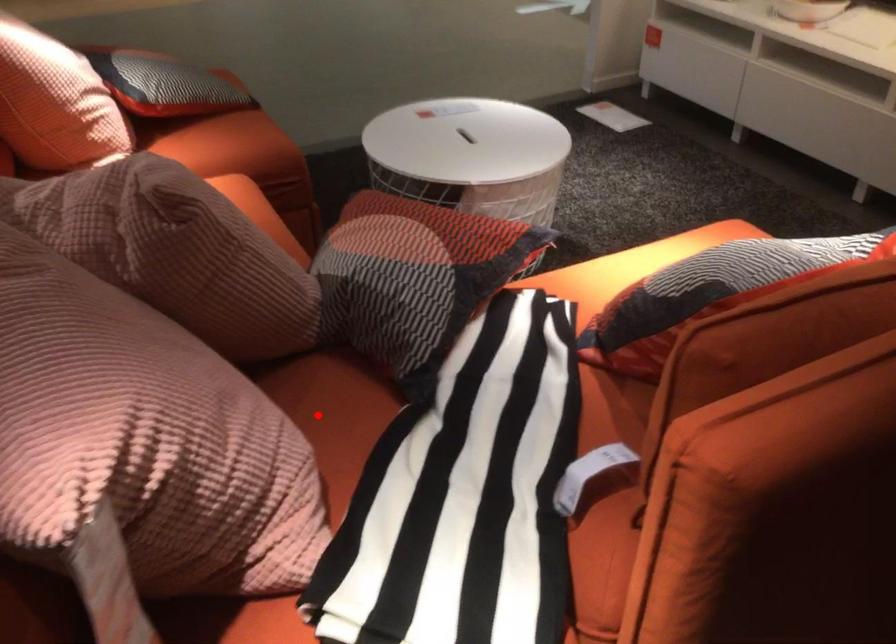
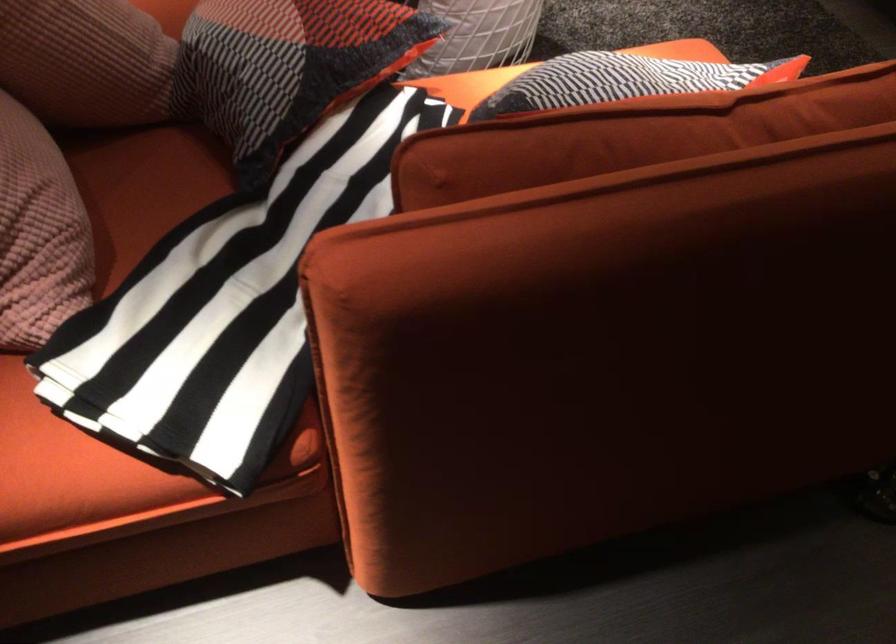
Question: I am providing you with two images of the same scene from different viewpoints. A red point is marked on the first image. At the location where the point appears in image 1, is it still visible in image 2?

Choices:
 (A) Yes
 (B) No

Answer: (A)